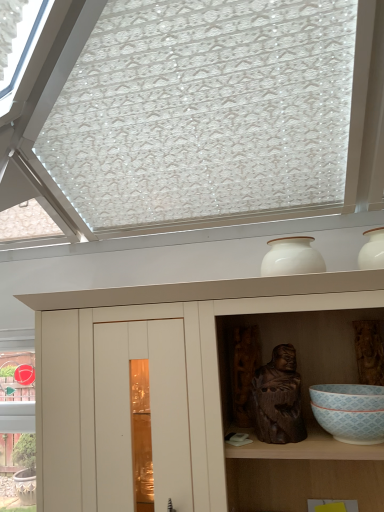
Question: From a real-world perspective, is white glossy vase at upper center above or below white glossy bowl at lower right?

Choices:
 (A) above
 (B) below

Answer: (A)

Question: Is white glossy vase at upper center bigger or smaller than white glossy bowl at lower right?

Choices:
 (A) big
 (B) small

Answer: (A)

Question: Which object is the closest to the dark brown wood statue at center?

Choices:
 (A) white glossy bowl at lower right
 (B) white glossy vase at upper center
 (C) white matte cupboard at upper center

Answer: (A)

Question: Which of these objects is positioned closest to the white matte cupboard at upper center?

Choices:
 (A) dark brown wood statue at center
 (B) white glossy vase at upper center
 (C) white glossy bowl at lower right

Answer: (A)